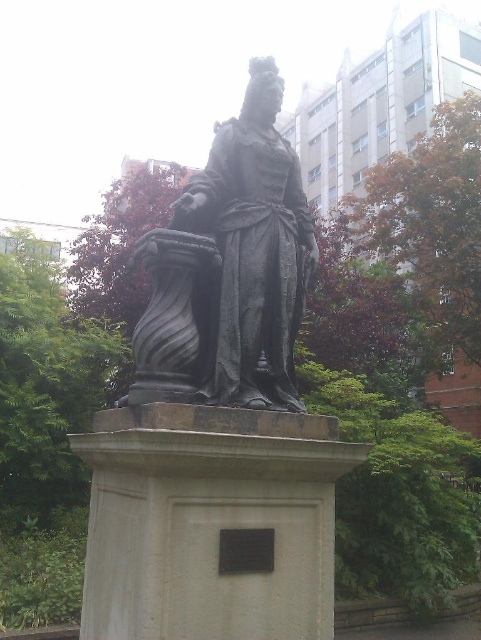
Question: Can you confirm if polished bronze statue at center is wider than bronze statue at center?

Choices:
 (A) yes
 (B) no

Answer: (A)

Question: Which of the following is the farthest from the observer?

Choices:
 (A) polished bronze statue at center
 (B) bronze statue at center

Answer: (B)

Question: Does polished bronze statue at center have a smaller size compared to bronze statue at center?

Choices:
 (A) no
 (B) yes

Answer: (A)

Question: Is polished bronze statue at center behind bronze statue at center?

Choices:
 (A) yes
 (B) no

Answer: (B)